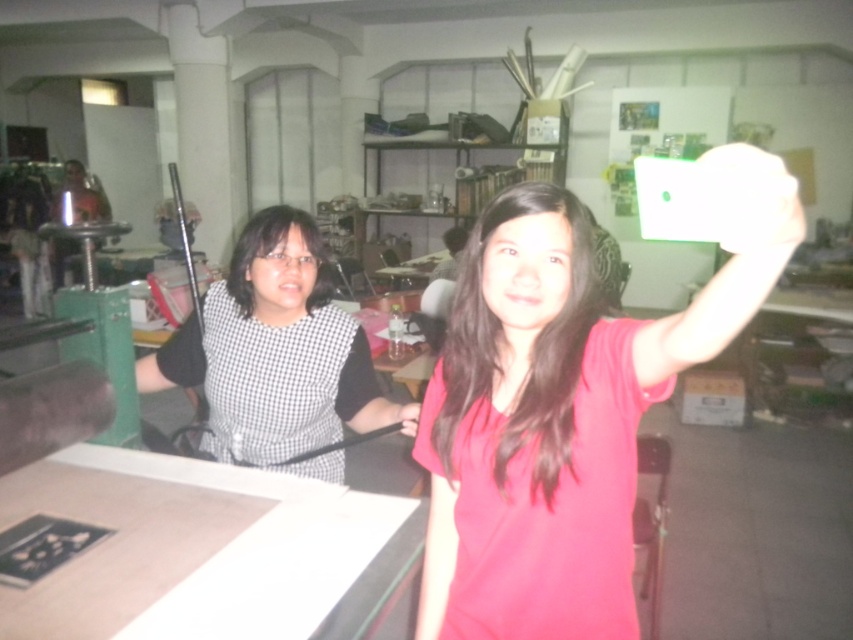
Question: Does matte red shirt at center lie in front of black checkered dress at left?

Choices:
 (A) no
 (B) yes

Answer: (B)

Question: Which point is farther from the camera taking this photo?

Choices:
 (A) (527, 609)
 (B) (265, 413)

Answer: (B)

Question: Is matte red shirt at center positioned before black checkered dress at left?

Choices:
 (A) yes
 (B) no

Answer: (A)

Question: Does matte red shirt at center appear on the left side of black checkered dress at left?

Choices:
 (A) yes
 (B) no

Answer: (B)